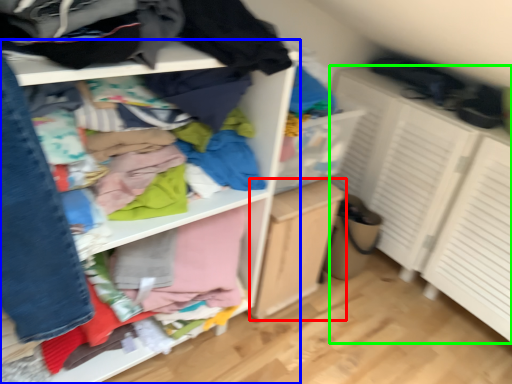
Question: Which is farther away from file cabinet (highlighted by a red box)? shelf (highlighted by a blue box) or cabinetry (highlighted by a green box)?

Choices:
 (A) shelf
 (B) cabinetry

Answer: (B)